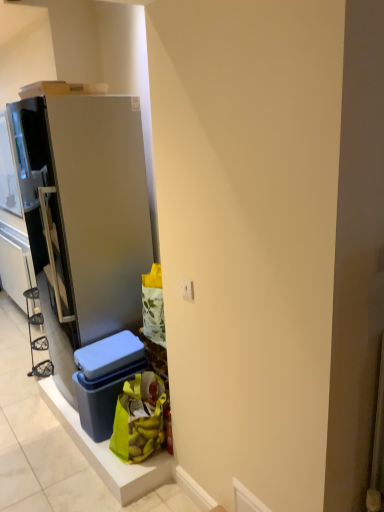
Question: Does point 112,434 appear closer or farther from the camera than point 125,336?

Choices:
 (A) farther
 (B) closer

Answer: (B)

Question: Would you say green fabric bag at lower center is to the left or to the right of matte blue plastic storage box at lower center in the picture?

Choices:
 (A) right
 (B) left

Answer: (A)

Question: Which object is the farthest from the matte blue plastic storage box at lower center?

Choices:
 (A) satin silver refrigerator at left
 (B) green fabric bag at lower center
 (C) white plastic electric outlet at center

Answer: (C)

Question: Estimate the real-world distances between objects in this image. Which object is farther from the white plastic electric outlet at center?

Choices:
 (A) satin silver refrigerator at left
 (B) green fabric bag at lower center
 (C) matte blue plastic storage box at lower center

Answer: (A)